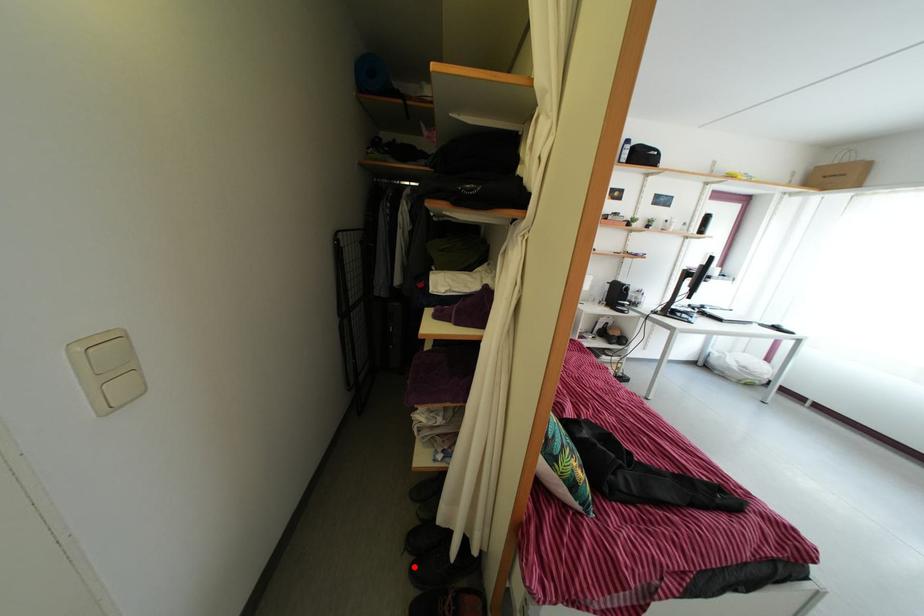
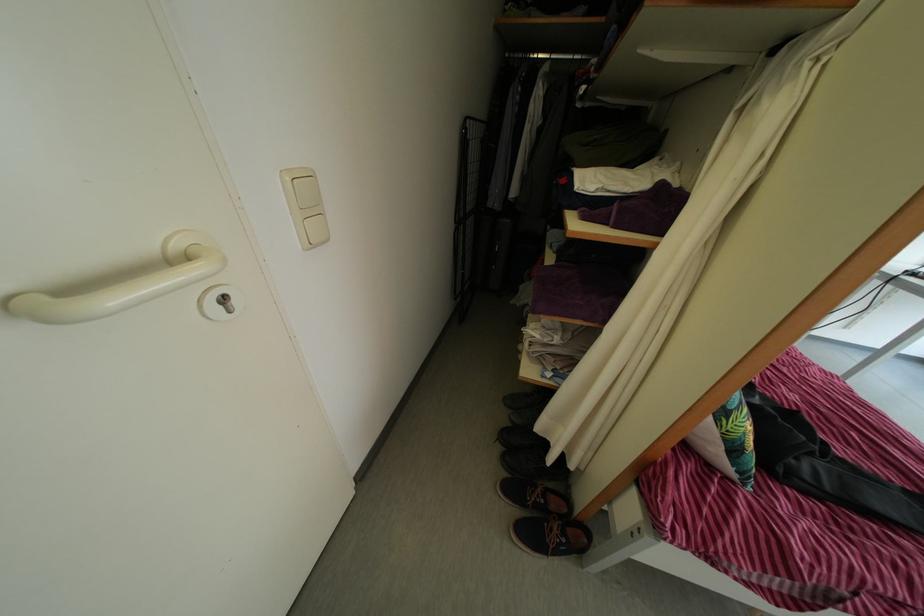
The point at the highlighted location is marked in the first image. Where is the corresponding point in the second image?

(505, 456)